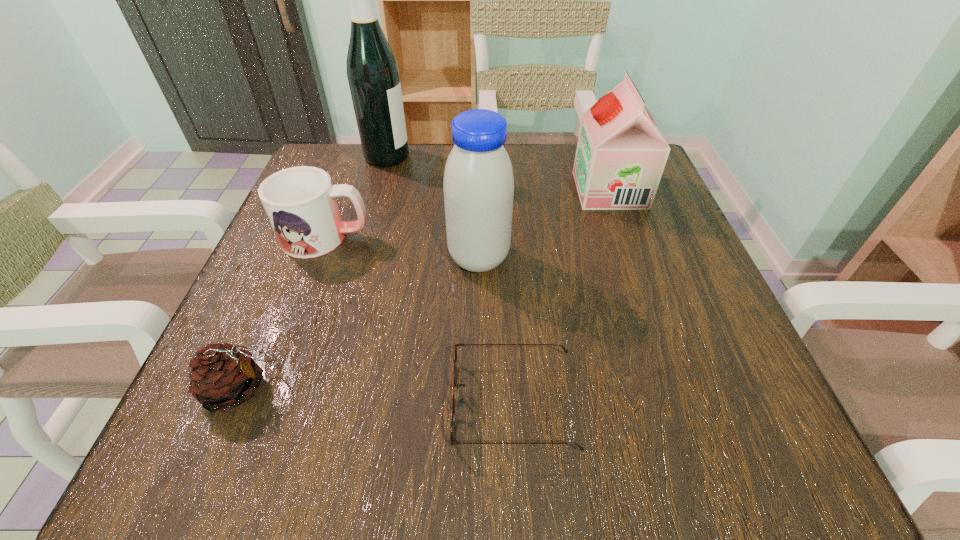
Locate an element on the screen. soya milk that is at the far edge is located at coordinates (621, 154).

The width and height of the screenshot is (960, 540). What are the coordinates of `pinecone present at the near edge` in the screenshot? It's located at (222, 377).

Locate an element on the screen. This screenshot has width=960, height=540. sunglasses that is at the near edge is located at coordinates (461, 402).

The image size is (960, 540). I want to click on wine bottle that is at the left edge, so click(x=372, y=70).

Image resolution: width=960 pixels, height=540 pixels. I want to click on mug located in the left edge section of the desktop, so click(x=300, y=202).

Image resolution: width=960 pixels, height=540 pixels. Find the location of `pinecone at the left edge`. pinecone at the left edge is located at coordinates (222, 377).

Locate an element on the screen. The width and height of the screenshot is (960, 540). object at the right edge is located at coordinates (621, 154).

I want to click on object present at the far left corner, so click(x=372, y=70).

This screenshot has width=960, height=540. Identify the location of object that is positioned at the near left corner. (222, 377).

This screenshot has width=960, height=540. Identify the location of object at the far right corner. (621, 154).